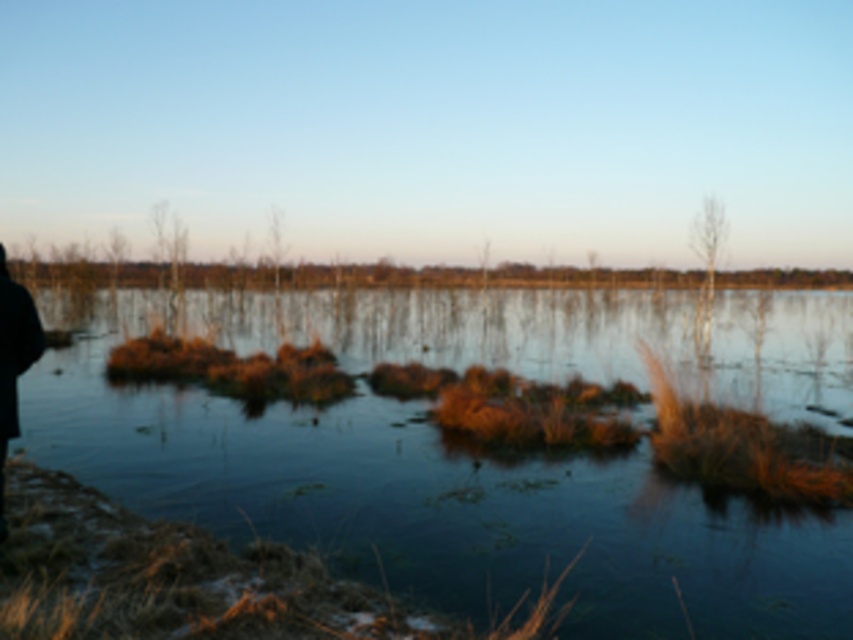
Who is higher up, brown grassy lake at center or black fabric person at left?

brown grassy lake at center is above.

Is point (416, 298) behind point (16, 317)?

That is True.

Does point (590, 548) come closer to viewer compared to point (10, 339)?

No.

Where is `brown grassy lake at center`? This screenshot has height=640, width=853. brown grassy lake at center is located at coordinates (474, 451).